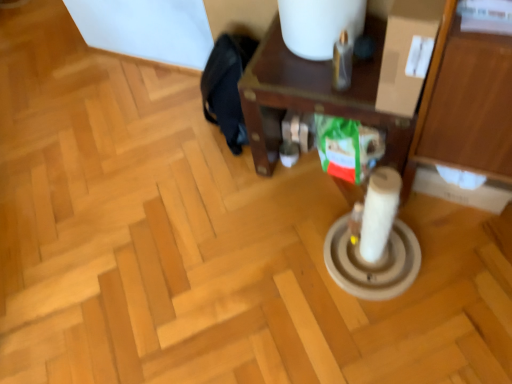
Find the location of a particular element. vacant space positioned to the left of brown wooden side table at center is located at coordinates (225, 205).